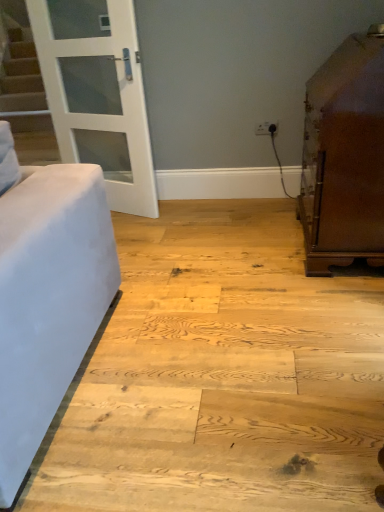
Describe the element at coordinates (266, 129) in the screenshot. The image size is (384, 512). I see `white plastic outlet at upper center` at that location.

Identify the location of brown polished cabinet at right. (344, 157).

Locate an element on the screen. Image resolution: width=384 pixels, height=512 pixels. white plastic outlet at upper center is located at coordinates (266, 129).

Is point (332, 167) positioned in front of point (101, 73)?

Yes, point (332, 167) is in front of point (101, 73).

Visually, is brown polished cabinet at right positioned to the left or to the right of white glass door at upper left?

brown polished cabinet at right is positioned on white glass door at upper left's right side.

Where is `furniture in front of the white glass door at upper left`? furniture in front of the white glass door at upper left is located at coordinates (344, 157).

Can you confirm if brown polished cabinet at right is taller than white glass door at upper left?

Incorrect, the height of brown polished cabinet at right is not larger of that of white glass door at upper left.

I want to click on door that appears above the brown polished cabinet at right (from a real-world perspective), so click(x=98, y=94).

From a real-world perspective, who is located higher, white glass door at upper left or brown polished cabinet at right?

white glass door at upper left is physically above.

Considering the relative positions of white glass door at upper left and brown polished cabinet at right in the image provided, is white glass door at upper left to the left or to the right of brown polished cabinet at right?

white glass door at upper left is positioned on brown polished cabinet at right's left side.

Is point (74, 68) closer to camera compared to point (308, 204)?

No, it is not.

Does point (383, 170) appear closer or farther from the camera than point (262, 126)?

Point (383, 170) is positioned closer to the camera compared to point (262, 126).

Which of these two, brown polished cabinet at right or white plastic outlet at upper center, stands taller?

brown polished cabinet at right.

Considering the positions of objects brown polished cabinet at right and white plastic outlet at upper center in the image provided, who is in front, brown polished cabinet at right or white plastic outlet at upper center?

brown polished cabinet at right is more forward.

Identify the location of electric outlet that appears below the brown polished cabinet at right (from a real-world perspective). (266, 129).

Between white plastic outlet at upper center and brown polished cabinet at right, which one is positioned behind?

white plastic outlet at upper center.

Locate an element on the screen. This screenshot has width=384, height=512. electric outlet on the left side of brown polished cabinet at right is located at coordinates (266, 129).

Is white plastic outlet at upper center not close to brown polished cabinet at right?

No, white plastic outlet at upper center is not far from brown polished cabinet at right.

From the picture: From the image's perspective, is white glass door at upper left located beneath white plastic outlet at upper center?

No, from the image's perspective, white glass door at upper left is not beneath white plastic outlet at upper center.

Could you tell me if white glass door at upper left is facing white plastic outlet at upper center?

No, white glass door at upper left is not facing towards white plastic outlet at upper center.

Is white glass door at upper left outside of white plastic outlet at upper center?

white glass door at upper left lies outside white plastic outlet at upper center's area.

From a real-world perspective, which is physically above, white glass door at upper left or white plastic outlet at upper center?

white glass door at upper left.

Identify the location of electric outlet that is under the white glass door at upper left (from a real-world perspective). (266, 129).

Which is correct: white plastic outlet at upper center is inside white glass door at upper left, or outside of it?

The correct answer is: outside.

Which object is closer to the camera, white plastic outlet at upper center or white glass door at upper left?

Positioned in front is white glass door at upper left.

Considering the sizes of white plastic outlet at upper center and white glass door at upper left in the image, is white plastic outlet at upper center bigger or smaller than white glass door at upper left?

Clearly, white plastic outlet at upper center is smaller in size than white glass door at upper left.

What are the coordinates of `furniture on the right side of white glass door at upper left` in the screenshot? It's located at (344, 157).

There is a brown polished cabinet at right. At what (x,y) coordinates should I click in order to perform the action: click on door above it (from a real-world perspective). Please return your answer as a coordinate pair (x, y). This screenshot has height=512, width=384. Looking at the image, I should click on (98, 94).

Which object lies nearer to the anchor point white glass door at upper left, white plastic outlet at upper center or brown polished cabinet at right?

white plastic outlet at upper center lies closer to white glass door at upper left than the other object.

Considering their positions, is white plastic outlet at upper center positioned further to brown polished cabinet at right than white glass door at upper left?

Based on the image, white glass door at upper left appears to be further to brown polished cabinet at right.

Considering their positions, is brown polished cabinet at right positioned closer to white plastic outlet at upper center than white glass door at upper left?

brown polished cabinet at right is closer to white plastic outlet at upper center.

Based on the photo, from the image, which object appears to be farther from white plastic outlet at upper center, white glass door at upper left or brown polished cabinet at right?

white glass door at upper left lies further to white plastic outlet at upper center than the other object.

Looking at the image, which one is located closer to white glass door at upper left, brown polished cabinet at right or white plastic outlet at upper center?

white plastic outlet at upper center is closer to white glass door at upper left.

Estimate the real-world distances between objects in this image. Which object is closer to brown polished cabinet at right, white glass door at upper left or white plastic outlet at upper center?

Based on the image, white plastic outlet at upper center appears to be nearer to brown polished cabinet at right.

Image resolution: width=384 pixels, height=512 pixels. Identify the location of electric outlet located between white glass door at upper left and brown polished cabinet at right in the left-right direction. (266, 129).